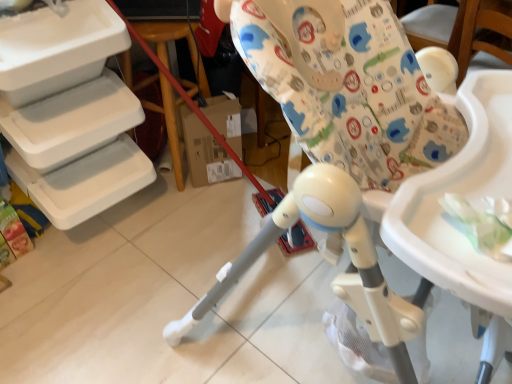
Describe the element at coordinates (337, 120) in the screenshot. I see `white plastic highchair at center` at that location.

Find the location of a particular element. This screenshot has height=384, width=512. white plastic highchair at center is located at coordinates (337, 120).

Find the location of a particular element. The width and height of the screenshot is (512, 384). wooden at left is located at coordinates (165, 78).

Image resolution: width=512 pixels, height=384 pixels. What do you see at coordinates (165, 78) in the screenshot?
I see `wooden at left` at bounding box center [165, 78].

Measure the distance between point (147, 33) and camera.

They are 1.49 meters apart.

You are a GUI agent. You are given a task and a screenshot of the screen. Output one action in this format:
    pyautogui.click(x=<x>, y=<y>)
    Task: Click on the white plastic highchair at center
    The height and width of the screenshot is (384, 512).
    Given the screenshot: What is the action you would take?
    337,120

Is wooden at left to the left of white plastic highchair at center from the viewer's perspective?

Correct, you'll find wooden at left to the left of white plastic highchair at center.

From the picture: Considering their positions, is wooden at left located in front of or behind white plastic highchair at center?

wooden at left is behind white plastic highchair at center.

Is point (128, 56) closer or farther from the camera than point (383, 325)?

Clearly, point (128, 56) is more distant from the camera than point (383, 325).

From the image's perspective, between wooden at left and white plastic highchair at center, who is located below?

white plastic highchair at center is shown below in the image.

From a real-world perspective, which is physically above, wooden at left or white plastic highchair at center?

white plastic highchair at center, from a real-world perspective.

Considering the relative sizes of wooden at left and white plastic highchair at center in the image provided, is wooden at left wider than white plastic highchair at center?

No, wooden at left is not wider than white plastic highchair at center.

Considering the sizes of wooden at left and white plastic highchair at center in the image, is wooden at left taller or shorter than white plastic highchair at center?

Clearly, wooden at left is shorter compared to white plastic highchair at center.

Which of these two, wooden at left or white plastic highchair at center, is bigger?

white plastic highchair at center is bigger.

Is white plastic highchair at center inside wooden at left?

No, wooden at left does not contain white plastic highchair at center.

Are wooden at left and white plastic highchair at center beside each other?

No.

Is wooden at left aimed at white plastic highchair at center?

Yes, wooden at left faces towards white plastic highchair at center.

How different are the orientations of wooden at left and white plastic highchair at center in degrees?

1.11 degrees.

The height and width of the screenshot is (384, 512). I want to click on table above the white plastic highchair at center (from the image's perspective), so click(x=165, y=78).

Considering the positions of objects white plastic highchair at center and wooden at left in the image provided, who is more to the right, white plastic highchair at center or wooden at left?

From the viewer's perspective, white plastic highchair at center appears more on the right side.

Which object is further away from the camera, white plastic highchair at center or wooden at left?

wooden at left is further away from the camera.

Considering the points (207, 296) and (174, 27), which point is in front, point (207, 296) or point (174, 27)?

Point (207, 296)

From the image's perspective, is white plastic highchair at center under wooden at left?

Yes, from the image's perspective, white plastic highchair at center is below wooden at left.

From a real-world perspective, is white plastic highchair at center beneath wooden at left?

No.

Can you confirm if white plastic highchair at center is thinner than wooden at left?

No, white plastic highchair at center is not thinner than wooden at left.

Who is taller, white plastic highchair at center or wooden at left?

Standing taller between the two is white plastic highchair at center.

Considering the sizes of white plastic highchair at center and wooden at left in the image, is white plastic highchair at center bigger or smaller than wooden at left?

Clearly, white plastic highchair at center is larger in size than wooden at left.

Looking at this image, is wooden at left located within white plastic highchair at center?

No, wooden at left is not a part of white plastic highchair at center.

Are white plastic highchair at center and wooden at left making contact?

white plastic highchair at center and wooden at left are not in contact.

Could you tell me if white plastic highchair at center is facing wooden at left?

No, white plastic highchair at center is not oriented towards wooden at left.

What's the angular difference between white plastic highchair at center and wooden at left's facing directions?

1.11 degrees separate the facing orientations of white plastic highchair at center and wooden at left.

You are a GUI agent. You are given a task and a screenshot of the screen. Output one action in this format:
    pyautogui.click(x=<x>, y=<y>)
    Task: Click on the table lying on the left of white plastic highchair at center
    
    Given the screenshot: What is the action you would take?
    pyautogui.click(x=165, y=78)

Locate an element on the screen. The image size is (512, 384). table on the left of the white plastic highchair at center is located at coordinates (165, 78).

Where is `chair that is above the wooden at left (from a real-world perspective)`? chair that is above the wooden at left (from a real-world perspective) is located at coordinates (337, 120).